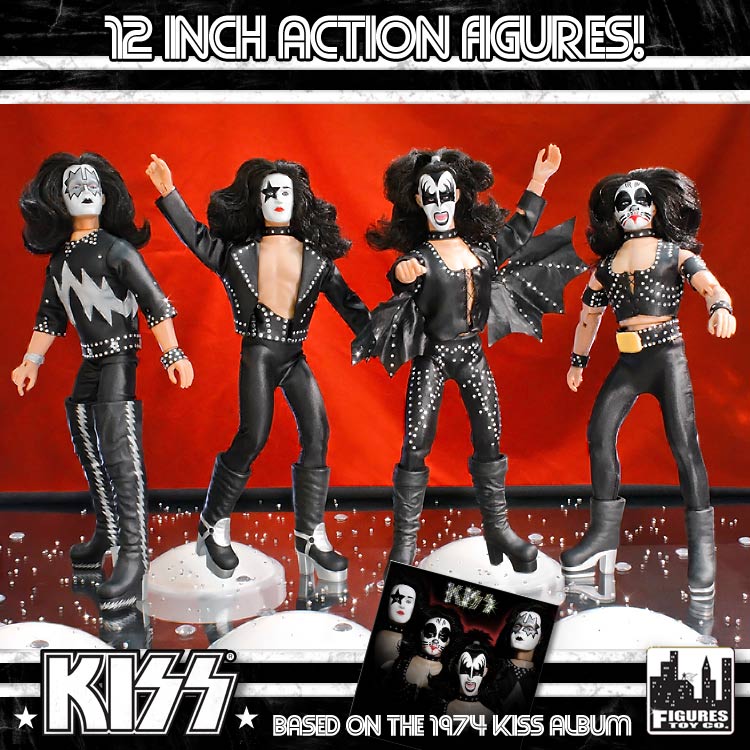
Locate an element on the screen. action figure is located at coordinates tap(93, 288), tap(252, 256), tap(454, 279), tap(637, 296), tap(388, 640), tap(427, 654), tap(478, 684), tap(531, 650).